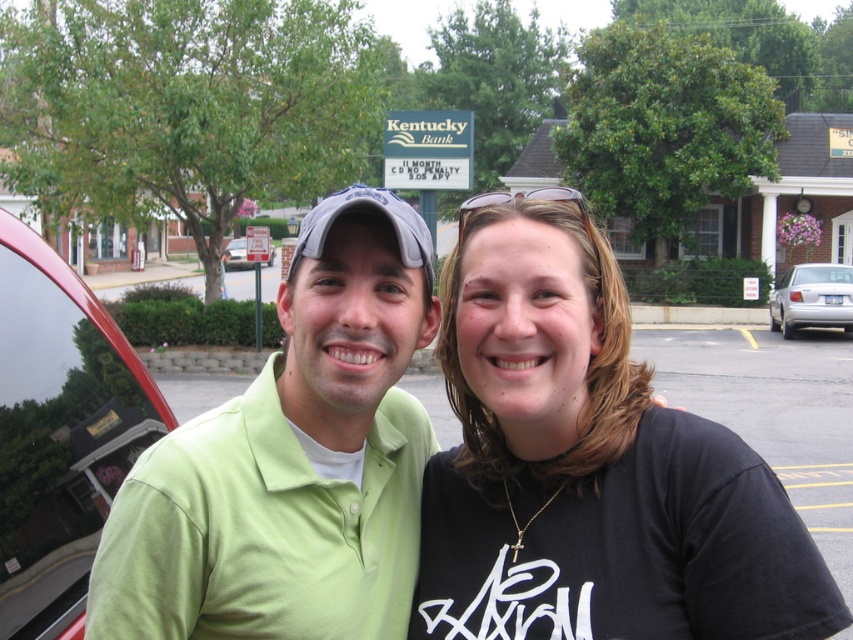
Which is in front, point (241, 406) or point (815, 288)?

Point (241, 406) is in front.

From the picture: Which of these two, green cotton polo shirt at center or silver metallic sedan at right, stands shorter?

green cotton polo shirt at center is shorter.

Who is more distant from viewer, (93,612) or (833,307)?

Point (833,307)

I want to click on green cotton polo shirt at center, so 292,460.

Can you confirm if green cotton shirt at center is positioned to the left of metallic silver car at left?

Incorrect, green cotton shirt at center is not on the left side of metallic silver car at left.

Which is in front, point (646, 582) or point (242, 237)?

Point (646, 582) is more forward.

This screenshot has height=640, width=853. Identify the location of green cotton shirt at center. (460, 467).

Is point (57, 522) closer to camera compared to point (830, 294)?

Yes, point (57, 522) is in front of point (830, 294).

Can you confirm if shiny red car at left is positioned above silver metallic sedan at right?

No, shiny red car at left is not above silver metallic sedan at right.

This screenshot has height=640, width=853. I want to click on shiny red car at left, so click(x=59, y=433).